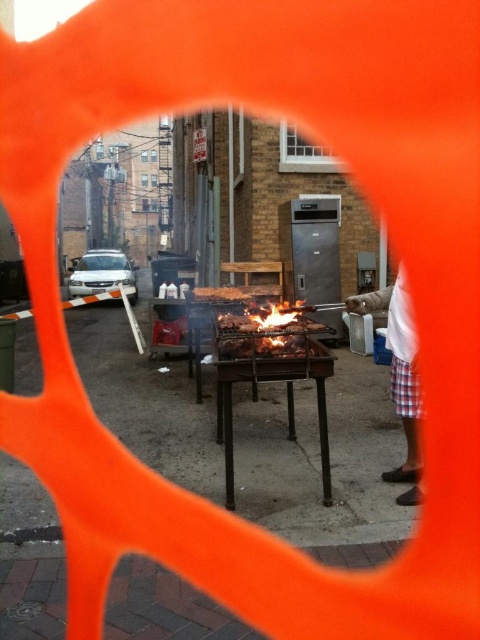
Question: Which object is closer to the camera taking this photo?

Choices:
 (A) white plaid shorts at right
 (B) charcoal black grill at center
 (C) flaming wood at center
 (D) charcoal grill at center

Answer: (B)

Question: Is charcoal black grill at center to the left of charcoal grill at center from the viewer's perspective?

Choices:
 (A) yes
 (B) no

Answer: (B)

Question: Is white plaid shorts at right bigger than flaming wood at center?

Choices:
 (A) no
 (B) yes

Answer: (B)

Question: Is flaming wood at center wider than charcoal grill at center?

Choices:
 (A) yes
 (B) no

Answer: (B)

Question: Which point is farther from the camera taking this photo?

Choices:
 (A) (292, 340)
 (B) (285, 340)
 (C) (396, 472)
 (D) (236, 291)

Answer: (D)

Question: Which point is closer to the camera?

Choices:
 (A) white plaid shorts at right
 (B) charcoal black grill at center

Answer: (B)